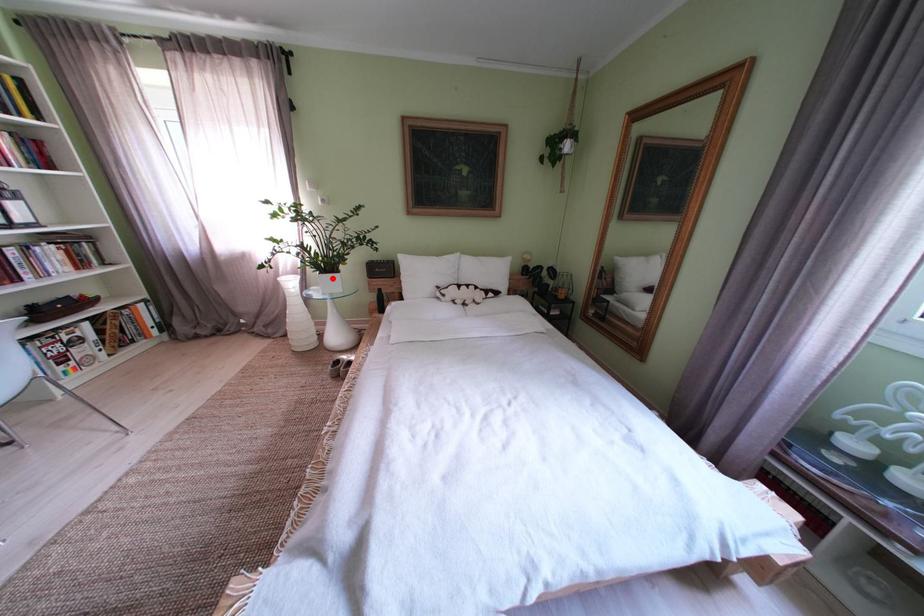
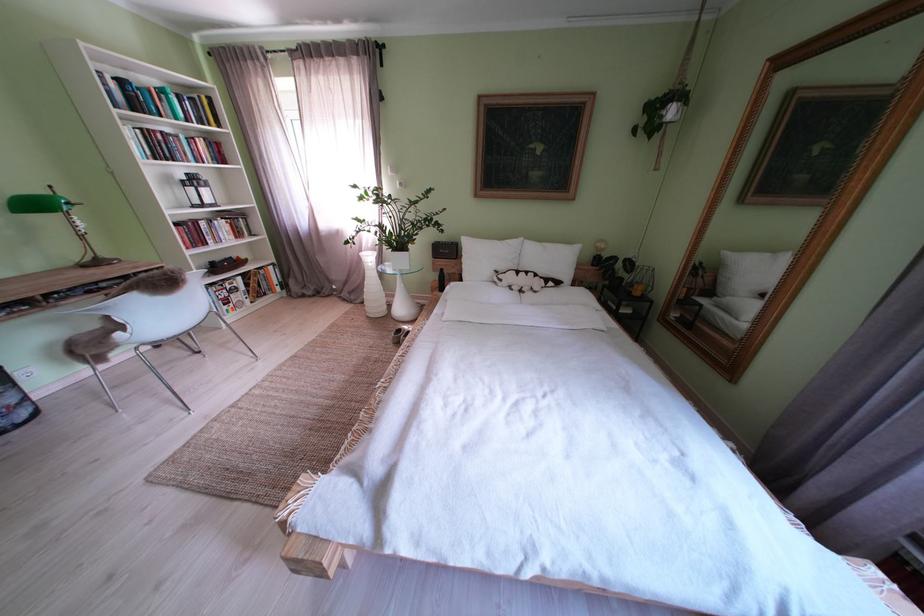
Where in the second image is the point corresponding to the highlighted location from the first image?

(405, 256)